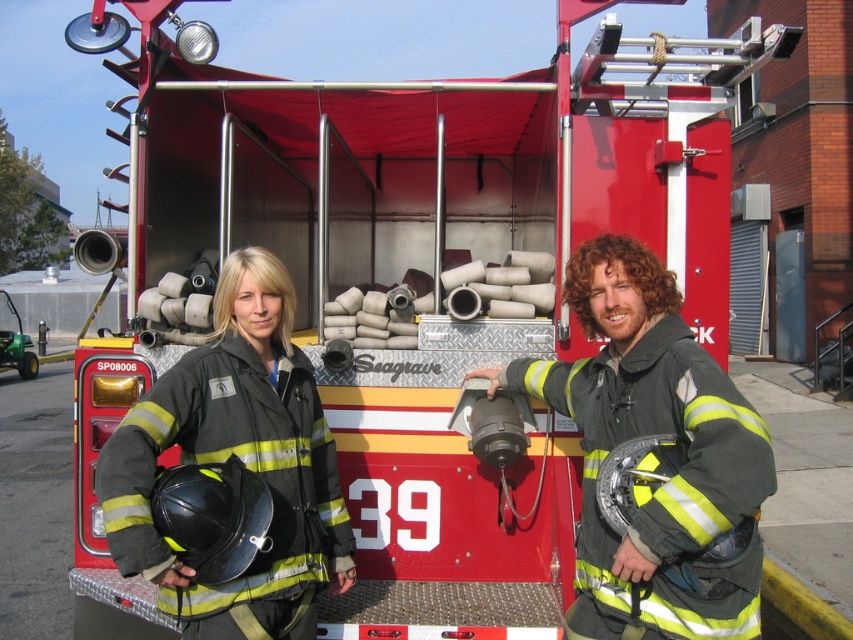
Can you confirm if black matte uniform at right is positioned to the right of black matte uniform at left?

Indeed, black matte uniform at right is positioned on the right side of black matte uniform at left.

Who is more forward, (724, 401) or (299, 412)?

Positioned in front is point (724, 401).

Which is behind, point (682, 484) or point (306, 596)?

Point (306, 596)

Identify the location of black matte uniform at right. The height and width of the screenshot is (640, 853). (662, 483).